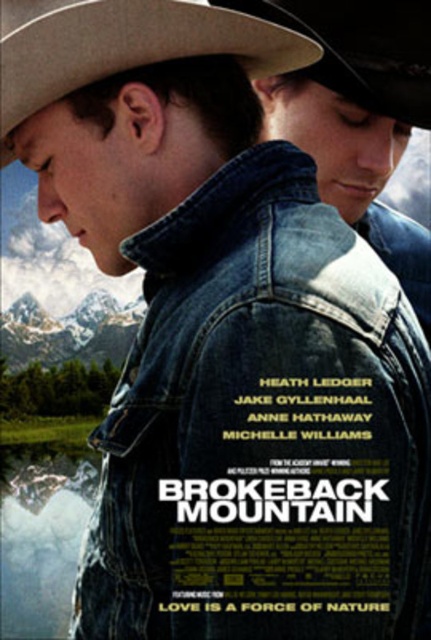
Is point (134, 360) in front of point (208, 45)?

No, it is not.

Is denim jacket at center bigger than beige felt cowboy hat at upper left?

Yes.

Is point (97, 515) farther from viewer compared to point (161, 20)?

Yes, point (97, 515) is farther from viewer.

Where is `denim jacket at center`? This screenshot has height=640, width=431. denim jacket at center is located at coordinates (262, 428).

Is point (271, 625) positioned in front of point (400, 81)?

Yes, it is.

Who is higher up, denim jacket at center or rustic leather cowboy hat at upper center?

rustic leather cowboy hat at upper center is higher up.

Which is behind, point (283, 269) or point (359, 77)?

Positioned behind is point (359, 77).

Image resolution: width=431 pixels, height=640 pixels. I want to click on denim jacket at center, so click(262, 428).

Is beige felt cowboy hat at upper left below rustic leather cowboy hat at upper center?

Indeed, beige felt cowboy hat at upper left is positioned under rustic leather cowboy hat at upper center.

Who is positioned more to the left, beige felt cowboy hat at upper left or rustic leather cowboy hat at upper center?

From the viewer's perspective, beige felt cowboy hat at upper left appears more on the left side.

Is point (230, 28) in front of point (346, 45)?

Yes.

In order to click on beige felt cowboy hat at upper left in this screenshot , I will do `click(124, 45)`.